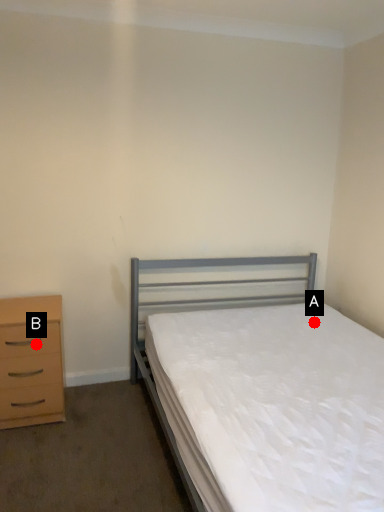
Question: Two points are circled on the image, labeled by A and B beside each circle. Which point appears closest to the camera in this image?

Choices:
 (A) A is closer
 (B) B is closer

Answer: (B)